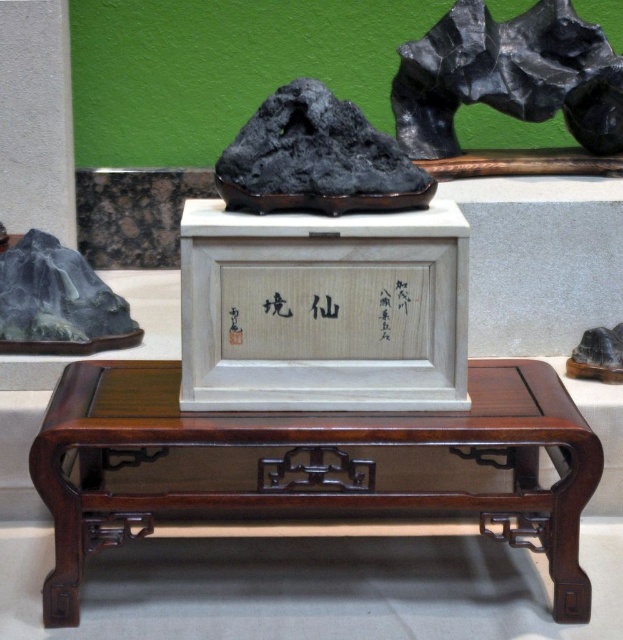
You are setting up a display and need to place a small vase that is 10 inches wide. You have the mahogany wood table at center and the matte black rock at right. Which surface can accommodate the vase without it overhanging?

The mahogany wood table at center is bigger than the matte black rock at right, so the vase can be placed on the mahogany wood table at center without overhanging.